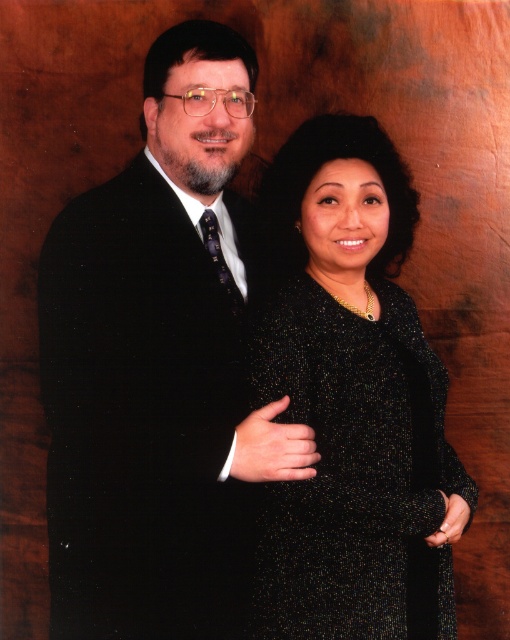
Question: Which object is farther from the camera taking this photo?

Choices:
 (A) satin black suit at left
 (B) sparkly black dress at center

Answer: (B)

Question: Can you confirm if satin black suit at left is thinner than sparkly black dress at center?

Choices:
 (A) yes
 (B) no

Answer: (B)

Question: Can you confirm if satin black suit at left is bigger than sparkly black dress at center?

Choices:
 (A) yes
 (B) no

Answer: (A)

Question: Which point is closer to the camera?

Choices:
 (A) (397, 534)
 (B) (242, 566)

Answer: (A)

Question: Is the position of satin black suit at left more distant than that of sparkly black dress at center?

Choices:
 (A) no
 (B) yes

Answer: (A)